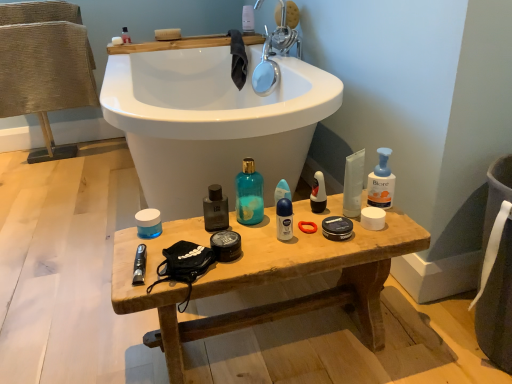
Where is `vacant area that is in front of matte black bottle at center, placed as the 5th toiletry when sorted from right to left`? This screenshot has width=512, height=384. vacant area that is in front of matte black bottle at center, placed as the 5th toiletry when sorted from right to left is located at coordinates (233, 259).